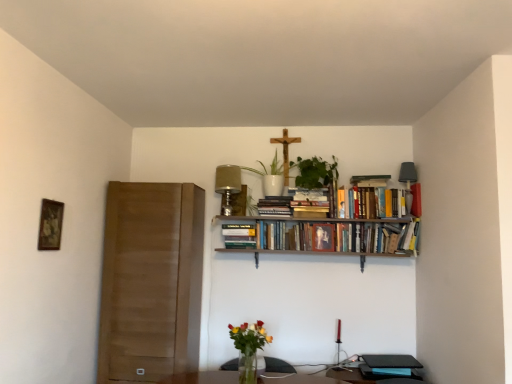
This screenshot has width=512, height=384. In order to click on free space to the left of hardcover book at upper right, which is counted as the fifth book, starting from the left in this screenshot , I will do `click(398, 222)`.